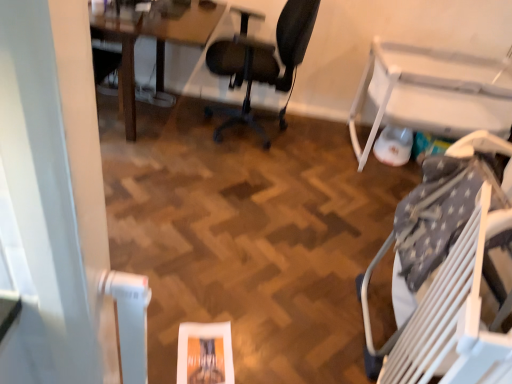
Question: Does wooden table at upper left, placed as the first table when sorted from left to right, turn towards black mesh office chair at center, acting as the second chair starting from the right?

Choices:
 (A) yes
 (B) no

Answer: (A)

Question: From a real-world perspective, is wooden table at upper left, which appears as the second table when viewed from the right, positioned over black mesh office chair at center, acting as the second chair starting from the right, based on gravity?

Choices:
 (A) yes
 (B) no

Answer: (B)

Question: Is wooden table at upper left, placed as the first table when sorted from left to right, bigger than black mesh office chair at center, acting as the second chair starting from the right?

Choices:
 (A) no
 (B) yes

Answer: (A)

Question: Is wooden table at upper left, which appears as the second table when viewed from the right, positioned behind black mesh office chair at center, the second chair when ordered from bottom to top?

Choices:
 (A) yes
 (B) no

Answer: (A)

Question: Is wooden table at upper left, placed as the first table when sorted from left to right, looking in the opposite direction of black mesh office chair at center, the second chair when ordered from front to back?

Choices:
 (A) no
 (B) yes

Answer: (A)

Question: From a real-world perspective, is white plastic table at right, which appears as the 1th table when viewed from the right, positioned above or below black mesh office chair at center, the second chair when ordered from bottom to top?

Choices:
 (A) below
 (B) above

Answer: (A)

Question: Is white plastic table at right, the 2th table when ordered from left to right, inside the boundaries of black mesh office chair at center, placed as the 1th chair when sorted from top to bottom, or outside?

Choices:
 (A) outside
 (B) inside

Answer: (A)

Question: Is white plastic table at right, the 2th table when ordered from left to right, bigger or smaller than black mesh office chair at center, acting as the second chair starting from the right?

Choices:
 (A) big
 (B) small

Answer: (A)

Question: In terms of width, does white plastic table at right, the 2th table when ordered from left to right, look wider or thinner when compared to black mesh office chair at center, the second chair when ordered from bottom to top?

Choices:
 (A) wide
 (B) thin

Answer: (A)

Question: Is black mesh office chair at center, the second chair when ordered from bottom to top, bigger or smaller than white plastic table at right, the 2th table when ordered from left to right?

Choices:
 (A) small
 (B) big

Answer: (A)

Question: Considering the relative positions of black mesh office chair at center, the second chair when ordered from front to back, and white plastic table at right, the 2th table when ordered from left to right, in the image provided, is black mesh office chair at center, the second chair when ordered from front to back, to the left or to the right of white plastic table at right, the 2th table when ordered from left to right,?

Choices:
 (A) left
 (B) right

Answer: (A)

Question: Is black mesh office chair at center, placed as the 1th chair when sorted from top to bottom, situated inside white plastic table at right, the 2th table when ordered from left to right, or outside?

Choices:
 (A) outside
 (B) inside

Answer: (A)

Question: Considering the positions of point pyautogui.click(x=273, y=77) and point pyautogui.click(x=391, y=122), is point pyautogui.click(x=273, y=77) closer or farther from the camera than point pyautogui.click(x=391, y=122)?

Choices:
 (A) farther
 (B) closer

Answer: (A)

Question: Is wooden table at upper left, placed as the first table when sorted from left to right, in front of or behind black mesh office chair at center, which appears as the first chair when viewed from the left, in the image?

Choices:
 (A) front
 (B) behind

Answer: (B)

Question: From the image's perspective, is wooden table at upper left, which appears as the second table when viewed from the right, located above or below black mesh office chair at center, the second chair when ordered from front to back?

Choices:
 (A) above
 (B) below

Answer: (A)